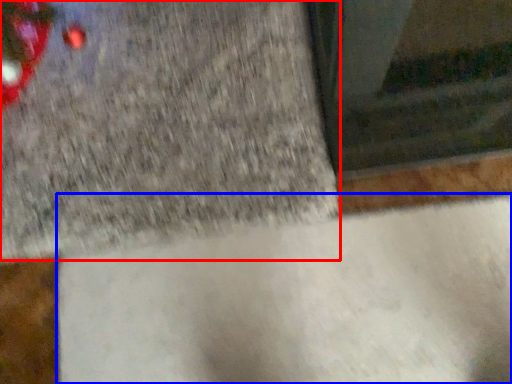
Question: Which of the following is the farthest to the observer, concrete (highlighted by a red box) or concrete (highlighted by a blue box)?

Choices:
 (A) concrete
 (B) concrete

Answer: (A)